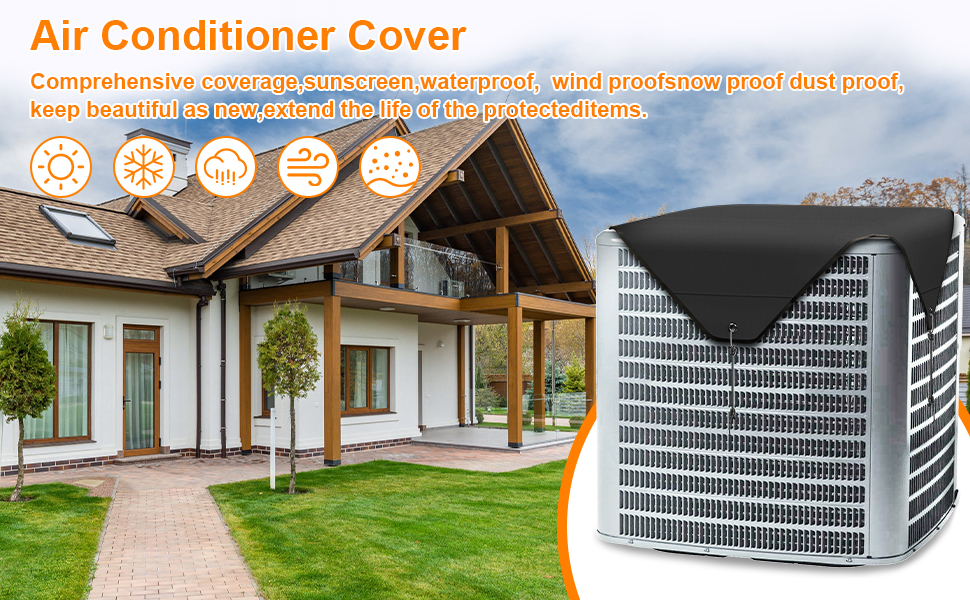
The height and width of the screenshot is (600, 970). I want to click on sconce light, so click(106, 331).